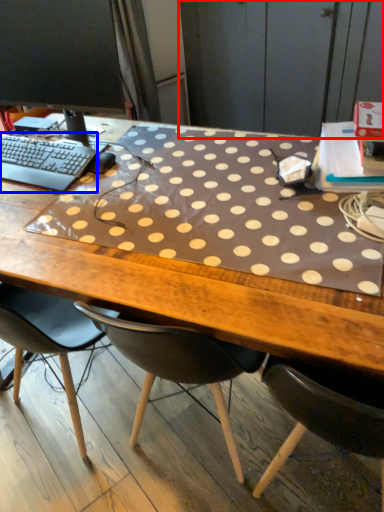
Question: Which object appears closest to the camera in this image, dresser (highlighted by a red box) or computer keyboard (highlighted by a blue box)?

Choices:
 (A) dresser
 (B) computer keyboard

Answer: (B)